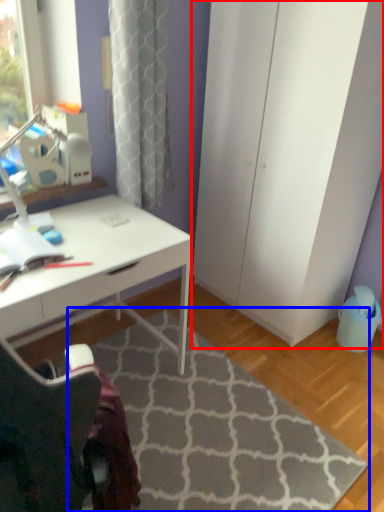
Question: Which of the following is the farthest to the observer, screen door (highlighted by a red box) or doormat (highlighted by a blue box)?

Choices:
 (A) screen door
 (B) doormat

Answer: (A)